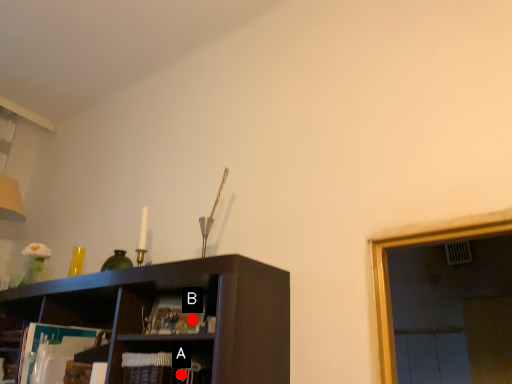
Question: Two points are circled on the image, labeled by A and B beside each circle. Which point appears farthest from the camera in this image?

Choices:
 (A) A is further
 (B) B is further

Answer: (B)